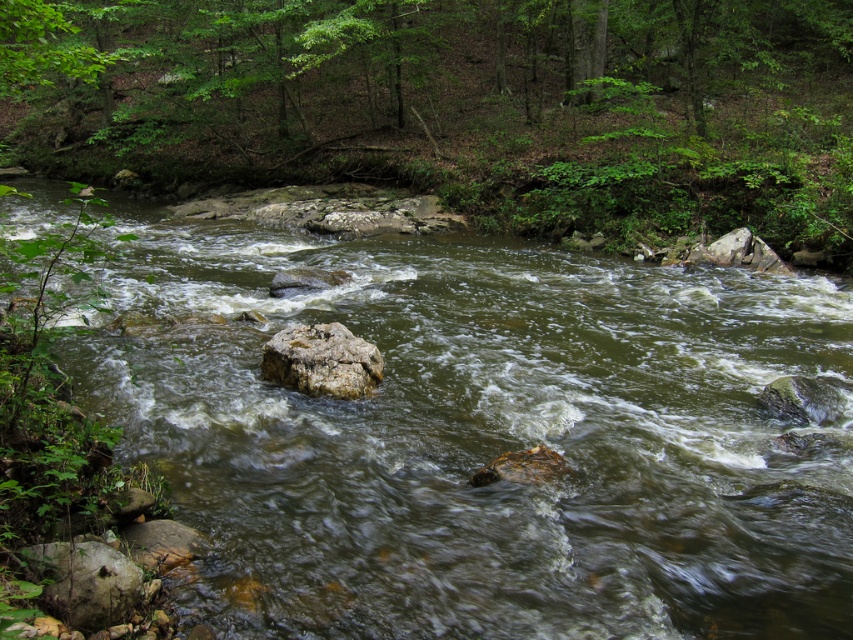
Question: Can you confirm if smooth gray rock at lower left is smaller than rough textured rock at center?

Choices:
 (A) no
 (B) yes

Answer: (B)

Question: Which of the following is the farthest from the observer?

Choices:
 (A) rough textured rock at center
 (B) smooth gray rock at lower left

Answer: (A)

Question: Considering the real-world distances, which object is closest to the green mossy rock at center?

Choices:
 (A) smooth gray rock at lower left
 (B) rough textured rock at center

Answer: (B)

Question: Is green leafy tree at upper center further to the viewer compared to rough textured rock at center?

Choices:
 (A) yes
 (B) no

Answer: (B)

Question: Estimate the real-world distances between objects in this image. Which object is closer to the green leafy tree at upper center?

Choices:
 (A) smooth gray rock at lower left
 (B) green mossy rock at center

Answer: (B)

Question: Can you confirm if green mossy rock at center is positioned below smooth gray rock at lower left?

Choices:
 (A) no
 (B) yes

Answer: (A)